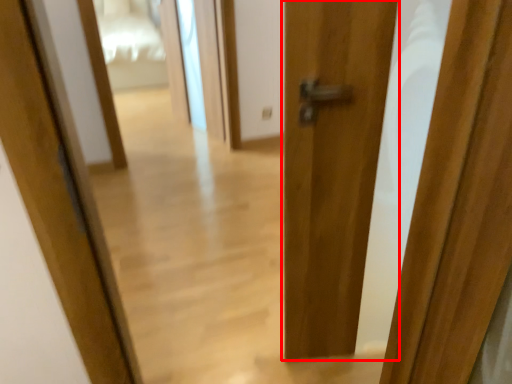
Question: From the image's perspective, considering the relative positions of door (annotated by the red box) and screen door in the image provided, where is door (annotated by the red box) located with respect to the staircase?

Choices:
 (A) below
 (B) above

Answer: (A)